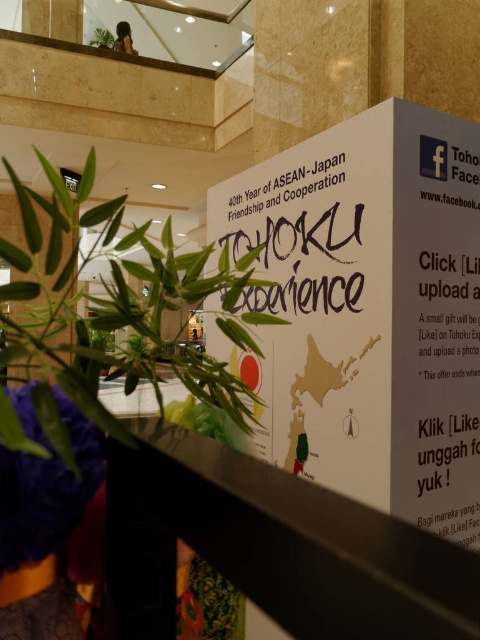
Is white paper sign at center wider than green leafy plant at lower left?

Incorrect, white paper sign at center's width does not surpass green leafy plant at lower left's.

Which is below, white paper sign at center or green leafy plant at lower left?

white paper sign at center is lower down.

At what (x,y) coordinates should I click in order to perform the action: click on white paper sign at center. Please return your answer as a coordinate pair (x, y). Looking at the image, I should click on (367, 310).